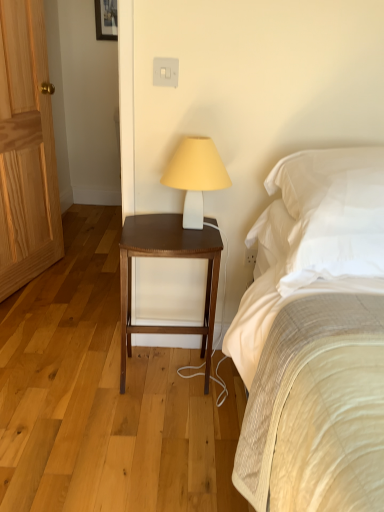
Question: Is white matte table lamp at upper center taller or shorter than white soft pillow at upper right?

Choices:
 (A) short
 (B) tall

Answer: (B)

Question: Visually, is white matte table lamp at upper center positioned to the left or to the right of white soft pillow at upper right?

Choices:
 (A) right
 (B) left

Answer: (B)

Question: Estimate the real-world distances between objects in this image. Which object is closer to the dark wood nightstand at center?

Choices:
 (A) white soft pillow at upper right
 (B) natural wood door at left
 (C) white matte table lamp at upper center

Answer: (C)

Question: Which object is the farthest from the white matte table lamp at upper center?

Choices:
 (A) white soft pillow at upper right
 (B) natural wood door at left
 (C) dark wood nightstand at center

Answer: (B)